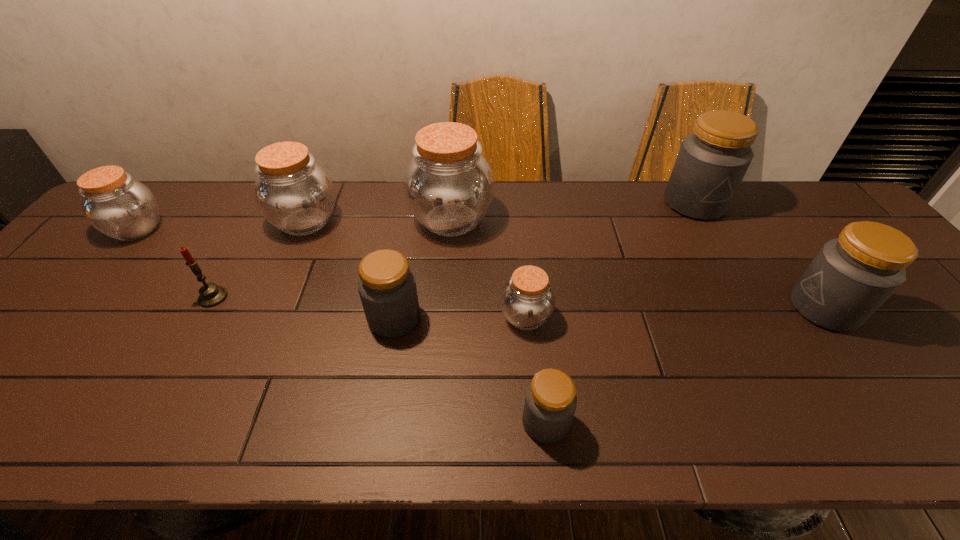
Locate an element on the screen. empty space between the second gray jar from left to right and the candle is located at coordinates (379, 360).

You are a GUI agent. You are given a task and a screenshot of the screen. Output one action in this format:
    pyautogui.click(x=<x>, y=<y>)
    Task: Click on the empty space that is in between the smallest brown jar and the third biggest gray jar
    
    Given the screenshot: What is the action you would take?
    pyautogui.click(x=460, y=318)

You are a GUI agent. You are given a task and a screenshot of the screen. Output one action in this format:
    pyautogui.click(x=<x>, y=<y>)
    Task: Click on the free space between the second brown jar from left to right and the smallest gray jar
    
    Given the screenshot: What is the action you would take?
    pyautogui.click(x=425, y=322)

Locate an element on the screen. The image size is (960, 540). empty space that is in between the third gray jar from right to left and the third smallest gray jar is located at coordinates (685, 365).

The height and width of the screenshot is (540, 960). What are the coordinates of `the fourth closest object to the third smallest gray jar` in the screenshot? It's located at (448, 184).

At what (x,y) coordinates should I click in order to perform the action: click on the eighth closest object to the second jar from left to right. Please return your answer as a coordinate pair (x, y). The image size is (960, 540). Looking at the image, I should click on (851, 276).

This screenshot has height=540, width=960. Identify the location of the seventh closest jar relative to the third smallest gray jar. tap(116, 205).

The image size is (960, 540). I want to click on the second closest jar to the smallest gray jar, so click(387, 287).

Identify which gray jar is the second nearest to the biggest brown jar. Please provide its 2D coordinates. Your answer should be formatted as a tuple, i.e. [(x, y)], where the tuple contains the x and y coordinates of a point satisfying the conditions above.

[(550, 402)]

Identify the location of gray jar that is the second closest to the nearest gray jar. The image size is (960, 540). (851, 276).